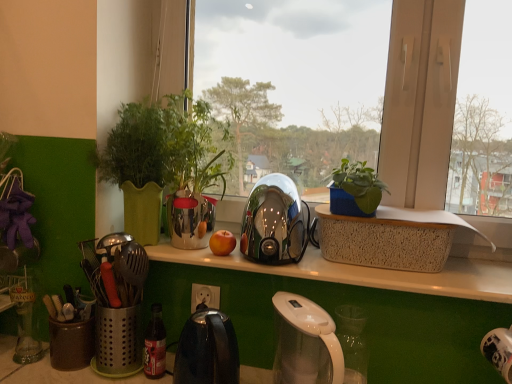
Identify the location of shiny metallic kettle at center, placed as the 1th kettle when sorted from top to bottom. Image resolution: width=512 pixels, height=384 pixels. (274, 222).

Find the location of `metallic utensil holder at left`. metallic utensil holder at left is located at coordinates (118, 298).

This screenshot has width=512, height=384. Describe the element at coordinates (222, 243) in the screenshot. I see `red matte apple at center` at that location.

The width and height of the screenshot is (512, 384). I want to click on white translucent coffee maker at lower center, so click(x=305, y=343).

Measure the distance between point (285, 365) and camera.

Point (285, 365) is 3.33 feet from camera.

I want to click on metallic silver kettle at center, so click(367, 93).

This screenshot has height=384, width=512. I want to click on shiny metallic kettle at center, placed as the 1th kettle when sorted from top to bottom, so click(274, 222).

From the image's perspective, relative to shiny metallic kettle at center, placed as the 1th kettle when sorted from top to bottom, is metallic silver kettle at center above or below?

metallic silver kettle at center is above shiny metallic kettle at center, placed as the 1th kettle when sorted from top to bottom.

Considering the relative sizes of metallic silver kettle at center and shiny metallic kettle at center, which is counted as the 2th kettle, starting from the bottom, in the image provided, is metallic silver kettle at center wider than shiny metallic kettle at center, which is counted as the 2th kettle, starting from the bottom,?

No.

Is metallic silver kettle at center positioned with its back to shiny metallic kettle at center, which is counted as the 2th kettle, starting from the bottom?

Yes.

How much distance is there between metallic silver kettle at center and shiny metallic kettle at center, placed as the 1th kettle when sorted from top to bottom?

metallic silver kettle at center and shiny metallic kettle at center, placed as the 1th kettle when sorted from top to bottom, are 2.36 meters apart.

Is shiny black kettle at center, which appears as the 2th kettle when viewed from the top, not within matte plastic bottle at lower center?

Absolutely, shiny black kettle at center, which appears as the 2th kettle when viewed from the top, is external to matte plastic bottle at lower center.

Considering the relative sizes of shiny black kettle at center, which appears as the 2th kettle when viewed from the top, and matte plastic bottle at lower center in the image provided, is shiny black kettle at center, which appears as the 2th kettle when viewed from the top, wider than matte plastic bottle at lower center?

Yes, shiny black kettle at center, which appears as the 2th kettle when viewed from the top, is wider than matte plastic bottle at lower center.

From the picture: Between shiny black kettle at center, which appears as the 2th kettle when viewed from the top, and matte plastic bottle at lower center, which one has less height?

Standing shorter between the two is matte plastic bottle at lower center.

Between point (194, 357) and point (152, 313), which one is positioned in front?

The point (194, 357) is more forward.

How much distance is there between white translucent coffee maker at lower center and shiny black kettle at center, the first kettle in the bottom-to-top sequence?

white translucent coffee maker at lower center is 17.77 centimeters from shiny black kettle at center, the first kettle in the bottom-to-top sequence.

From the image's perspective, between white translucent coffee maker at lower center and shiny black kettle at center, which appears as the 2th kettle when viewed from the top, which one is located above?

white translucent coffee maker at lower center, from the image's perspective.

Is white translucent coffee maker at lower center aimed at shiny black kettle at center, which appears as the 2th kettle when viewed from the top?

No, white translucent coffee maker at lower center does not turn towards shiny black kettle at center, which appears as the 2th kettle when viewed from the top.

Is point (471, 163) positioned in front of point (149, 361)?

No, (471, 163) is further to viewer.

Is metallic silver kettle at center oriented towards matte plastic bottle at lower center?

No, metallic silver kettle at center is not aimed at matte plastic bottle at lower center.

Is metallic silver kettle at center smaller than matte plastic bottle at lower center?

No, metallic silver kettle at center is not smaller than matte plastic bottle at lower center.

Considering the relative sizes of metallic silver kettle at center and matte plastic bottle at lower center in the image provided, is metallic silver kettle at center thinner than matte plastic bottle at lower center?

Yes, metallic silver kettle at center is thinner than matte plastic bottle at lower center.

From a real-world perspective, is white speckled tray at center above or below white translucent coffee maker at lower center?

In terms of real-world spatial position, white speckled tray at center is above white translucent coffee maker at lower center.

From the image's perspective, is white speckled tray at center positioned above or below white translucent coffee maker at lower center?

white speckled tray at center is situated higher than white translucent coffee maker at lower center in the image.

Is white speckled tray at center touching white translucent coffee maker at lower center?

No, white speckled tray at center is not beside white translucent coffee maker at lower center.

Locate an element on the screen. The height and width of the screenshot is (384, 512). coffee maker located on the left of white speckled tray at center is located at coordinates (305, 343).

Between point (222, 234) and point (200, 293), which one is positioned behind?

Positioned behind is point (200, 293).

Which of these two, red matte apple at center or white glossy power outlet at center, is smaller?

Answer: Smaller between the two is red matte apple at center.

Identify the location of apple in front of the white glossy power outlet at center. The image size is (512, 384). 222,243.

In the scene shown: Who is taller, red matte apple at center or white glossy power outlet at center?

white glossy power outlet at center is taller.

How far apart are shiny metallic kettle at center, placed as the 1th kettle when sorted from top to bottom, and white speckled tray at center?

A distance of 6.48 inches exists between shiny metallic kettle at center, placed as the 1th kettle when sorted from top to bottom, and white speckled tray at center.

Can you tell me how much shiny metallic kettle at center, which is counted as the 2th kettle, starting from the bottom, and white speckled tray at center differ in facing direction?

2.1 degrees.

Is shiny metallic kettle at center, placed as the 1th kettle when sorted from top to bottom, positioned with its back to white speckled tray at center?

No, white speckled tray at center is not at the back of shiny metallic kettle at center, placed as the 1th kettle when sorted from top to bottom.

Which of these two, shiny metallic kettle at center, placed as the 1th kettle when sorted from top to bottom, or white speckled tray at center, stands taller?

Standing taller between the two is shiny metallic kettle at center, placed as the 1th kettle when sorted from top to bottom.

From the metallic silver kettle at center, count 1st kettles forward and point to it. Please provide its 2D coordinates.

[(274, 222)]

The height and width of the screenshot is (384, 512). Identify the location of bottle on the left of shiny black kettle at center, which appears as the 2th kettle when viewed from the top. tap(155, 344).

Looking at the image, which one is located further to green matte plant at left, matte plastic bottle at lower center or white glossy power outlet at center?

Based on the image, matte plastic bottle at lower center appears to be further to green matte plant at left.

From the image, which object appears to be nearer to white glossy power outlet at center, metallic silver kettle at center or shiny metallic kettle at center, which is counted as the 2th kettle, starting from the bottom?

shiny metallic kettle at center, which is counted as the 2th kettle, starting from the bottom.

From the image, which object appears to be farther from shiny black kettle at center, the first kettle in the bottom-to-top sequence, white glossy power outlet at center or white speckled tray at center?

white speckled tray at center lies further to shiny black kettle at center, the first kettle in the bottom-to-top sequence, than the other object.

Considering their positions, is metallic silver kettle at center positioned closer to green matte plant at left than shiny metallic kettle at center, placed as the 1th kettle when sorted from top to bottom?

Based on the image, shiny metallic kettle at center, placed as the 1th kettle when sorted from top to bottom, appears to be nearer to green matte plant at left.

Which object lies nearer to the anchor point white glossy power outlet at center, matte plastic bottle at lower center or shiny black kettle at center, which appears as the 2th kettle when viewed from the top?

matte plastic bottle at lower center.

Estimate the real-world distances between objects in this image. Which object is closer to matte plastic bottle at lower center, green matte plant at left or white speckled tray at center?

Based on the image, green matte plant at left appears to be nearer to matte plastic bottle at lower center.

Which object lies nearer to the anchor point shiny metallic kettle at center, which is counted as the 2th kettle, starting from the bottom, matte plastic bottle at lower center or green matte plant at left?

Based on the image, green matte plant at left appears to be nearer to shiny metallic kettle at center, which is counted as the 2th kettle, starting from the bottom.

Looking at the image, which one is located further to white glossy power outlet at center, metallic utensil holder at left or green matte plant at left?

green matte plant at left is positioned further to the anchor white glossy power outlet at center.

Identify the location of apple situated between green matte plant at left and metallic silver kettle at center from left to right. This screenshot has height=384, width=512. (222, 243).

Locate an element on the screen. The width and height of the screenshot is (512, 384). power outlet between green matte plant at left and matte plastic bottle at lower center vertically is located at coordinates (205, 296).

This screenshot has height=384, width=512. Identify the location of kettle between metallic silver kettle at center and red matte apple at center in the vertical direction. (274, 222).

This screenshot has width=512, height=384. I want to click on window sill between green matte plant at left and white glossy power outlet at center in the vertical direction, so click(362, 272).